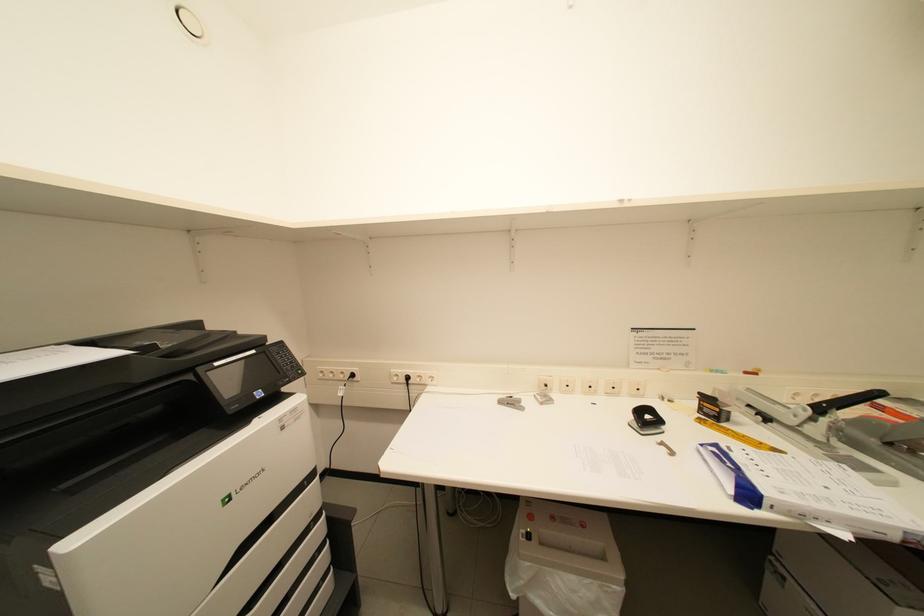
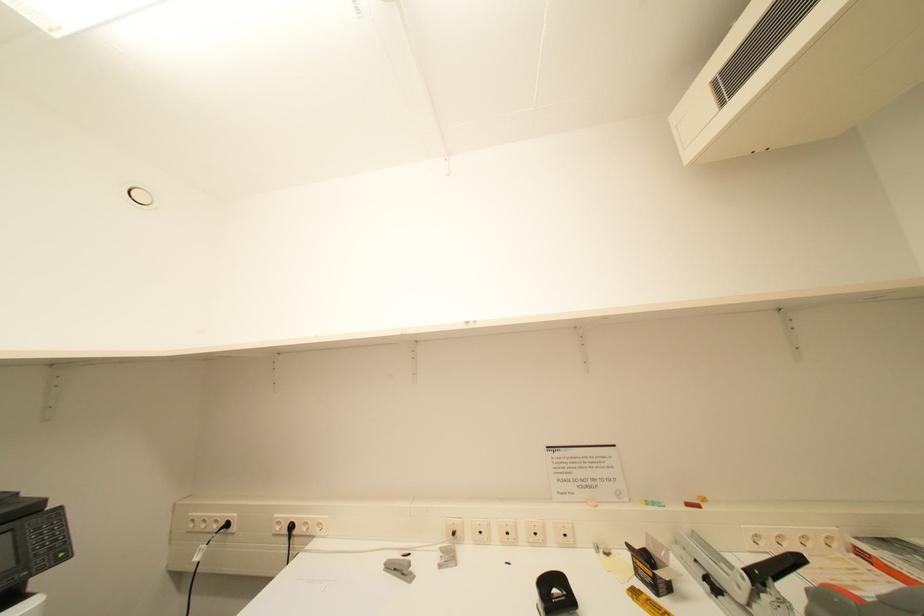
Question: The first image is from the beginning of the video and the second image is from the end. How did the camera likely rotate when shooting the video?

Choices:
 (A) Left
 (B) Right
 (C) Up
 (D) Down

Answer: (C)